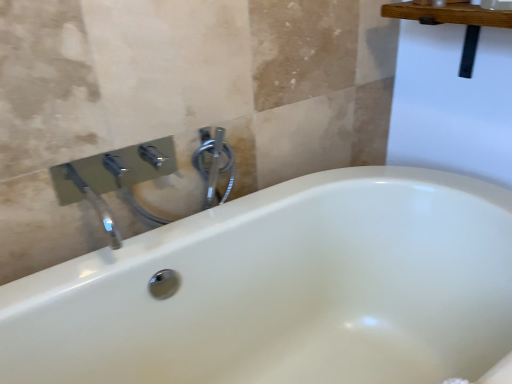
The width and height of the screenshot is (512, 384). Describe the element at coordinates (214, 165) in the screenshot. I see `polished chrome faucet at upper center` at that location.

This screenshot has width=512, height=384. In order to click on polished chrome faucet at upper center in this screenshot , I will do click(214, 165).

This screenshot has width=512, height=384. Describe the element at coordinates (115, 180) in the screenshot. I see `polished chrome faucet at upper left` at that location.

This screenshot has height=384, width=512. What are the coordinates of `polished chrome faucet at upper left` in the screenshot? It's located at (115, 180).

In order to face polished chrome faucet at upper left, should I rotate leftwards or rightwards?

Rotate your view left by about 11.137°.

This screenshot has width=512, height=384. I want to click on polished chrome faucet at upper center, so click(x=214, y=165).

Is polished chrome faucet at upper center to the right of polished chrome faucet at upper left from the viewer's perspective?

Yes, polished chrome faucet at upper center is to the right of polished chrome faucet at upper left.

Which object is more forward, polished chrome faucet at upper center or polished chrome faucet at upper left?

polished chrome faucet at upper left is in front.

Does point (212, 155) lie behind point (158, 219)?

No, (212, 155) is closer to viewer.

From the image's perspective, is polished chrome faucet at upper center located above polished chrome faucet at upper left?

Yes, from the image's perspective, polished chrome faucet at upper center is above polished chrome faucet at upper left.

From a real-world perspective, is polished chrome faucet at upper center over polished chrome faucet at upper left?

Yes, from a real-world perspective, polished chrome faucet at upper center is on top of polished chrome faucet at upper left.

Does polished chrome faucet at upper center have a lesser width compared to polished chrome faucet at upper left?

Correct, the width of polished chrome faucet at upper center is less than that of polished chrome faucet at upper left.

Is polished chrome faucet at upper center taller or shorter than polished chrome faucet at upper left?

In the image, polished chrome faucet at upper center appears to be shorter than polished chrome faucet at upper left.

In the scene shown: Is polished chrome faucet at upper center bigger or smaller than polished chrome faucet at upper left?

Clearly, polished chrome faucet at upper center is smaller in size than polished chrome faucet at upper left.

Is polished chrome faucet at upper center situated inside polished chrome faucet at upper left or outside?

polished chrome faucet at upper center is inside polished chrome faucet at upper left.

Are polished chrome faucet at upper center and polished chrome faucet at upper left far apart?

polished chrome faucet at upper center is actually quite close to polished chrome faucet at upper left.

Is polished chrome faucet at upper center turned away from polished chrome faucet at upper left?

Yes, polished chrome faucet at upper center's orientation is away from polished chrome faucet at upper left.

Find the location of a particular element. sink below the polished chrome faucet at upper center (from a real-world perspective) is located at coordinates (115, 180).

Can you confirm if polished chrome faucet at upper left is positioned to the left of polished chrome faucet at upper center?

Indeed, polished chrome faucet at upper left is positioned on the left side of polished chrome faucet at upper center.

Which is in front, polished chrome faucet at upper left or polished chrome faucet at upper center?

polished chrome faucet at upper left is more forward.

Between point (200, 154) and point (233, 176), which one is positioned behind?

Point (233, 176)

Consider the image. From the image's perspective, which is above, polished chrome faucet at upper left or polished chrome faucet at upper center?

polished chrome faucet at upper center appears higher in the image.

From a real-world perspective, is polished chrome faucet at upper left positioned under polished chrome faucet at upper center based on gravity?

Yes, from a real-world perspective, polished chrome faucet at upper left is below polished chrome faucet at upper center.

Is polished chrome faucet at upper left wider than polished chrome faucet at upper center?

Correct, the width of polished chrome faucet at upper left exceeds that of polished chrome faucet at upper center.

Is polished chrome faucet at upper left taller than polished chrome faucet at upper center?

Correct, polished chrome faucet at upper left is much taller as polished chrome faucet at upper center.

Considering the relative sizes of polished chrome faucet at upper left and polished chrome faucet at upper center in the image provided, is polished chrome faucet at upper left bigger than polished chrome faucet at upper center?

Yes, polished chrome faucet at upper left is bigger than polished chrome faucet at upper center.

Is polished chrome faucet at upper center completely or partially inside polished chrome faucet at upper left?

Yes, polished chrome faucet at upper center is surrounded by polished chrome faucet at upper left.

Is polished chrome faucet at upper left far away from polished chrome faucet at upper center?

polished chrome faucet at upper left is near polished chrome faucet at upper center, not far away.

Is polished chrome faucet at upper left facing towards polished chrome faucet at upper center?

No, polished chrome faucet at upper left is not oriented towards polished chrome faucet at upper center.

How far apart are polished chrome faucet at upper left and polished chrome faucet at upper center?

The distance of polished chrome faucet at upper left from polished chrome faucet at upper center is 4.41 inches.

Locate an element on the screen. sink below the polished chrome faucet at upper center (from a real-world perspective) is located at coordinates (115, 180).

Where is `sink on the left of polished chrome faucet at upper center`? This screenshot has width=512, height=384. sink on the left of polished chrome faucet at upper center is located at coordinates (115, 180).

Identify the location of sink below the polished chrome faucet at upper center (from the image's perspective). (115, 180).